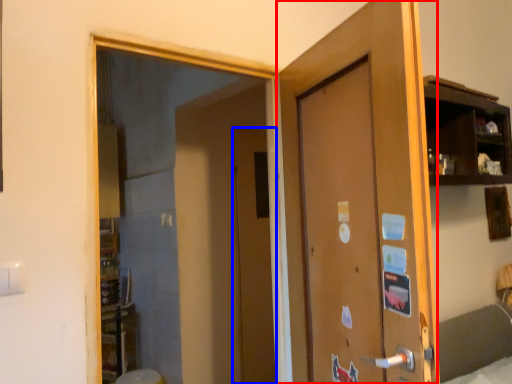
Question: Among these objects, which one is nearest to the camera, door (highlighted by a red box) or door (highlighted by a blue box)?

Choices:
 (A) door
 (B) door

Answer: (A)